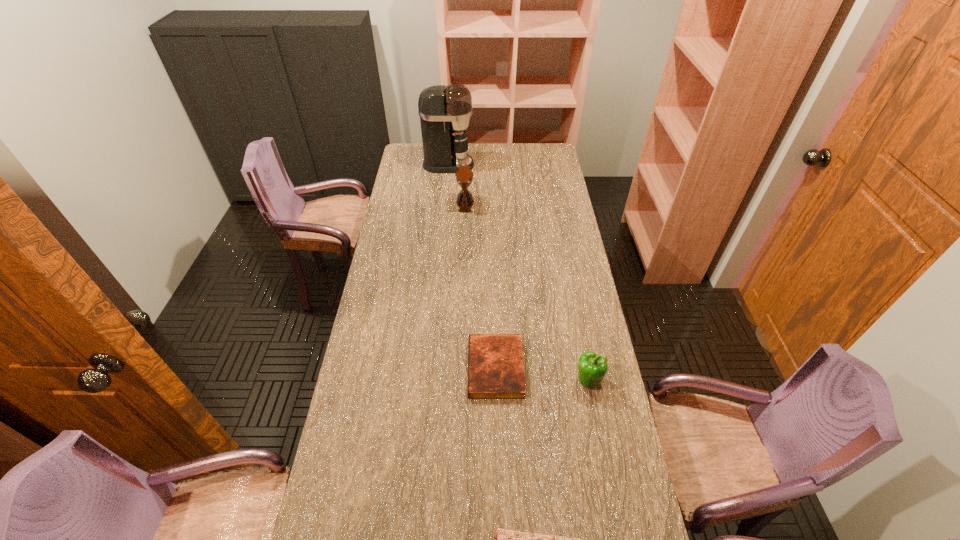
Image resolution: width=960 pixels, height=540 pixels. Find the location of `empty space that is in between the farthest object and the hourglass`. empty space that is in between the farthest object and the hourglass is located at coordinates (457, 184).

At what (x,y) coordinates should I click in order to perform the action: click on free space between the hourglass and the taller Bible. Please return your answer as a coordinate pair (x, y). The height and width of the screenshot is (540, 960). Looking at the image, I should click on (480, 286).

You are a GUI agent. You are given a task and a screenshot of the screen. Output one action in this format:
    pyautogui.click(x=<x>, y=<y>)
    Task: Click on the empty location between the fourth nearest object and the taller Bible
    Image resolution: width=960 pixels, height=540 pixels.
    Given the screenshot: What is the action you would take?
    pyautogui.click(x=480, y=286)

Where is `the third closest object relative to the bell pepper`? the third closest object relative to the bell pepper is located at coordinates (464, 176).

Select which object is the closest to the shortest object. Please provide its 2D coordinates. Your answer should be formatted as a tuple, i.e. [(x, y)], where the tuple contains the x and y coordinates of a point satisfying the conditions above.

[(495, 361)]

Where is `blank space that satisfies the following two spatial constraints: 1. on the spine side of the taller Bible; 2. on the back side of the bell pepper`? blank space that satisfies the following two spatial constraints: 1. on the spine side of the taller Bible; 2. on the back side of the bell pepper is located at coordinates (496, 380).

Find the location of a particular element. Image resolution: width=960 pixels, height=540 pixels. vacant region that satisfies the following two spatial constraints: 1. on the spine side of the farther Bible; 2. on the left side of the bell pepper is located at coordinates (496, 380).